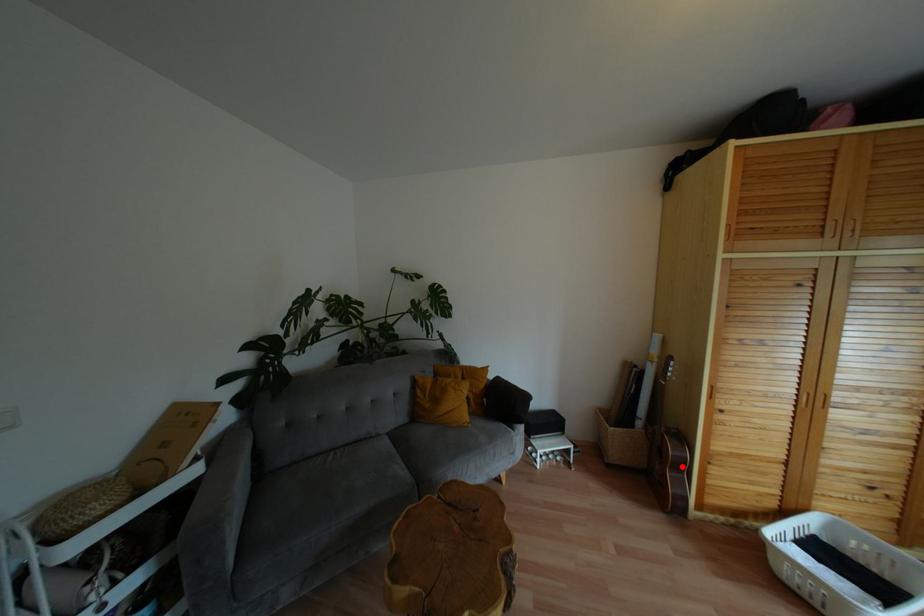
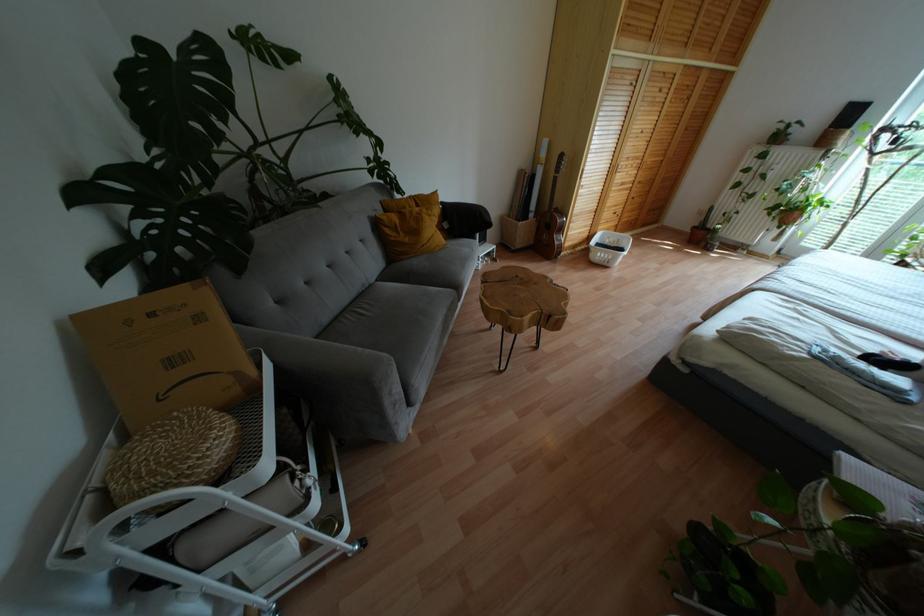
Question: I am providing you with two images of the same scene from different viewpoints. A red point is marked on the first image. Can you still see the location of the red point in image 2?

Choices:
 (A) Yes
 (B) No

Answer: (A)